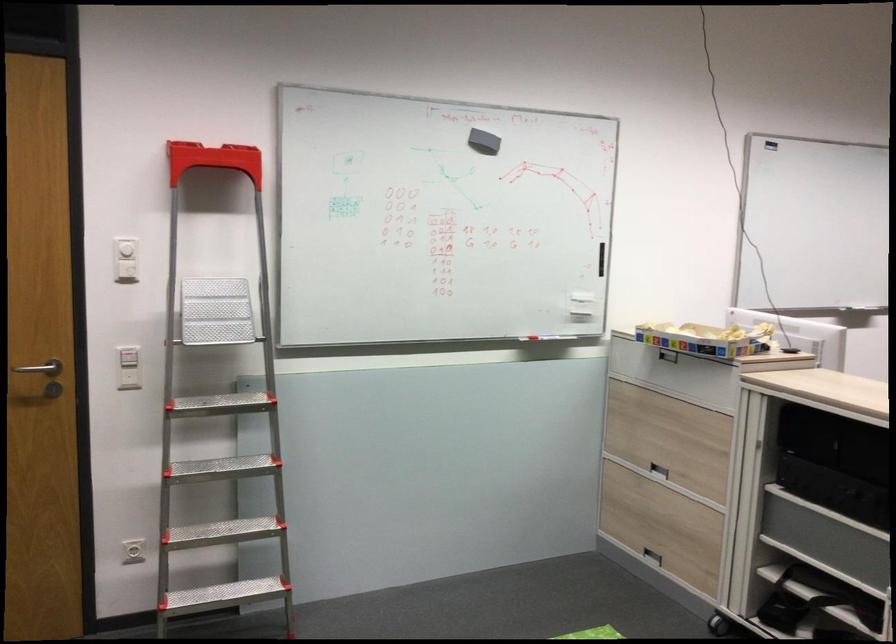
Find the location of `shallow cardboard box`. shallow cardboard box is located at coordinates (705, 339).